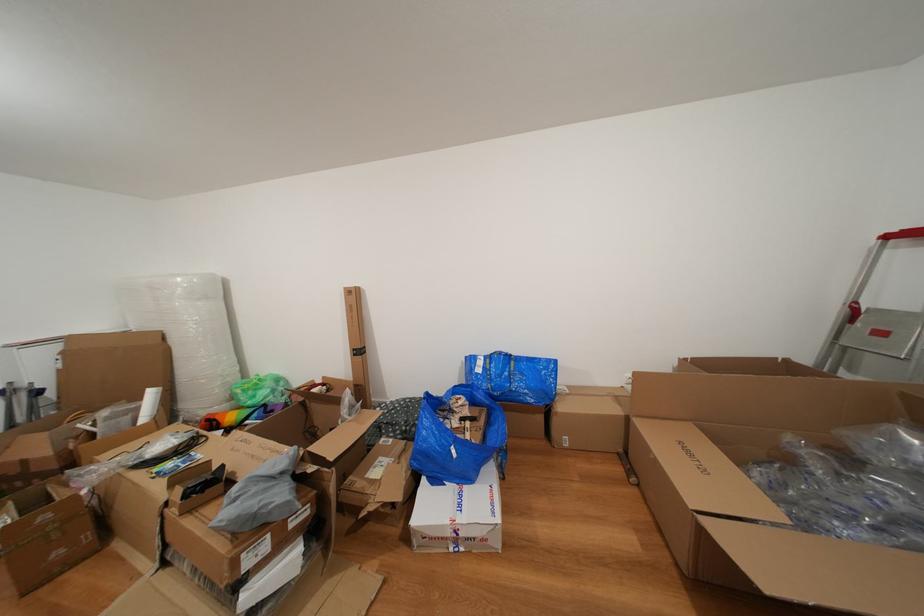
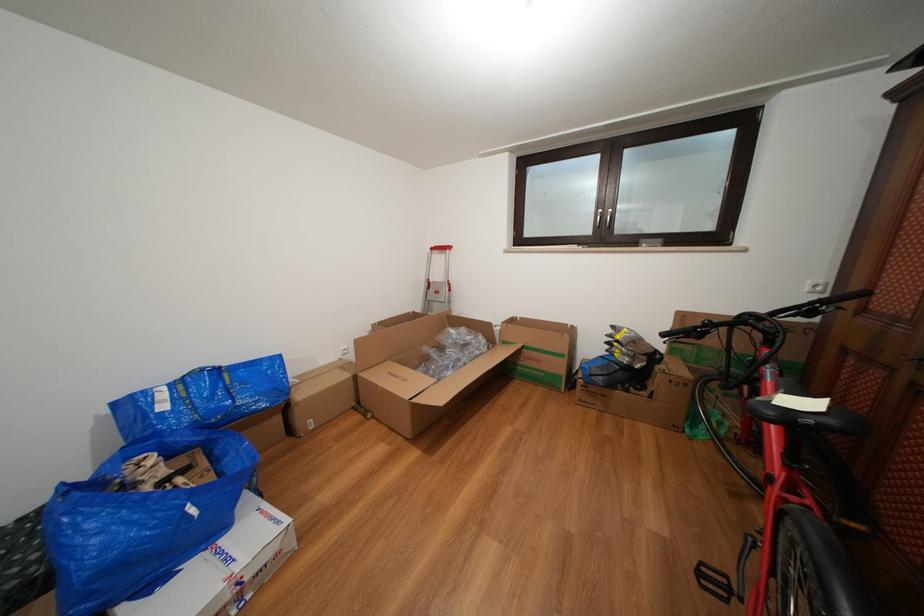
The point at (896, 241) is marked in the first image. Where is the corresponding point in the second image?

(441, 254)